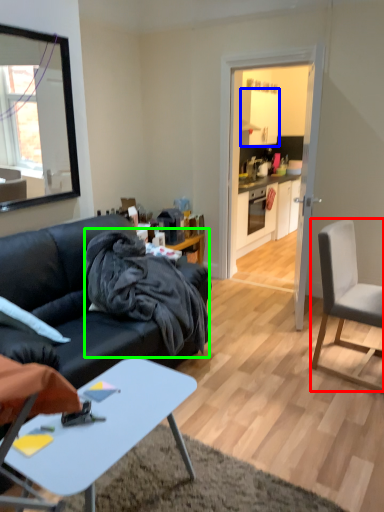
Question: Which object is positioned closest to chair (highlighted by a red box)? Select from cabinetry (highlighted by a blue box) and material (highlighted by a green box).

Choices:
 (A) cabinetry
 (B) material

Answer: (B)